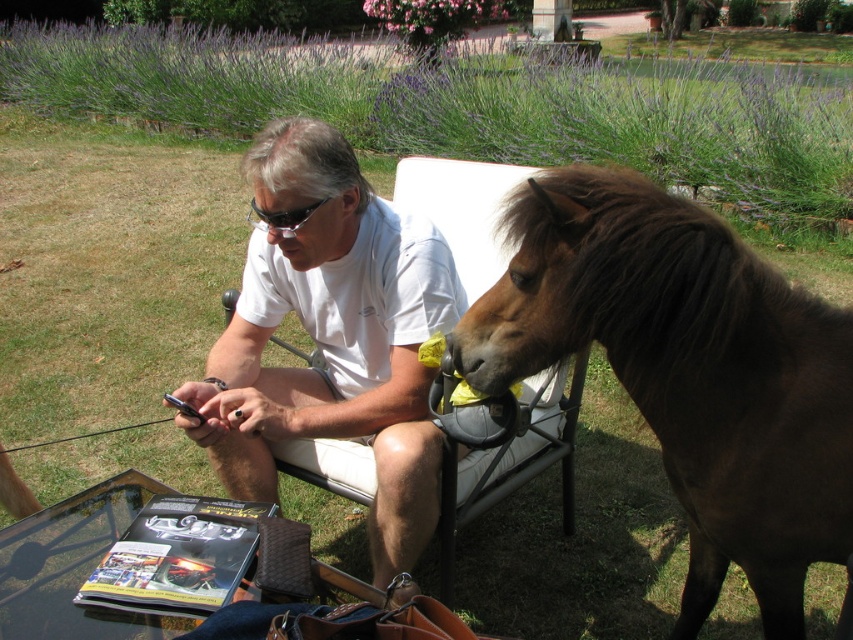
Does brown glossy horse at right appear under black plastic goggles at center?

Yes, brown glossy horse at right is below black plastic goggles at center.

Is point (693, 248) more distant than point (258, 220)?

No, (693, 248) is closer to viewer.

I want to click on brown glossy horse at right, so click(688, 371).

Is point (312, 156) less distant than point (292, 225)?

Yes, it is.

Is point (402, 560) farther from camera compared to point (281, 211)?

Yes, it is.

Locate an element on the screen. This screenshot has height=640, width=853. white cotton shirt at center is located at coordinates (332, 339).

Does brown glossy horse at right have a lesser height compared to white cotton shirt at center?

Yes, brown glossy horse at right is shorter than white cotton shirt at center.

Between point (798, 324) and point (321, 172), which one is positioned behind?

Positioned behind is point (321, 172).

Is point (770, 326) in front of point (322, 173)?

That is True.

The width and height of the screenshot is (853, 640). Find the location of `brown glossy horse at right`. brown glossy horse at right is located at coordinates (688, 371).